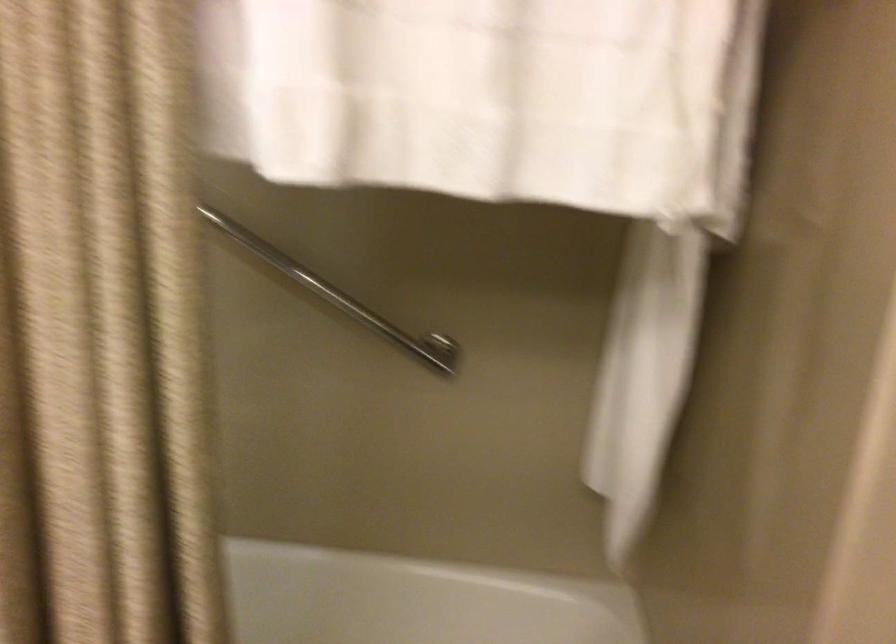
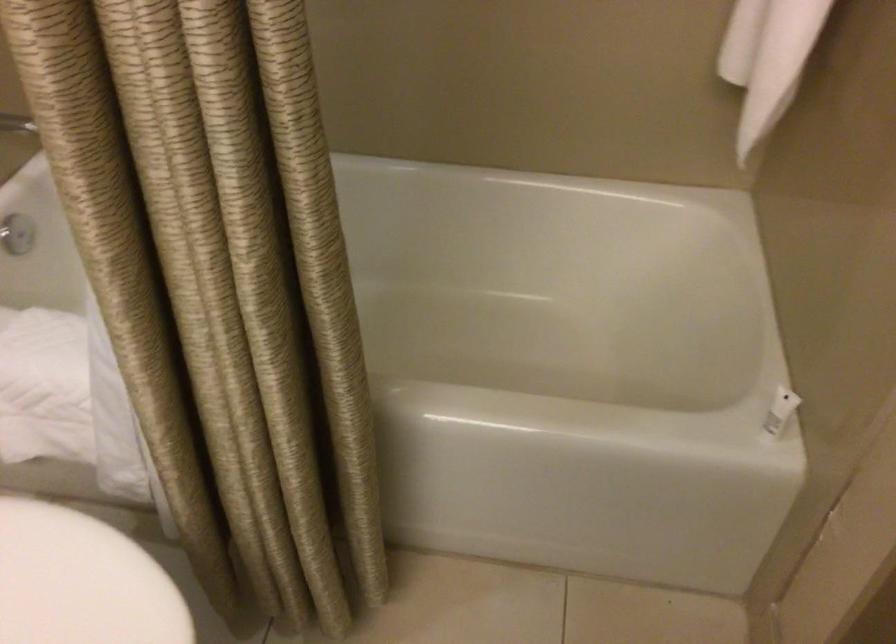
Question: The images are taken continuously from a first-person perspective. In which direction are you moving?

Choices:
 (A) Left
 (B) Right
 (C) Forward
 (D) Backward

Answer: (C)